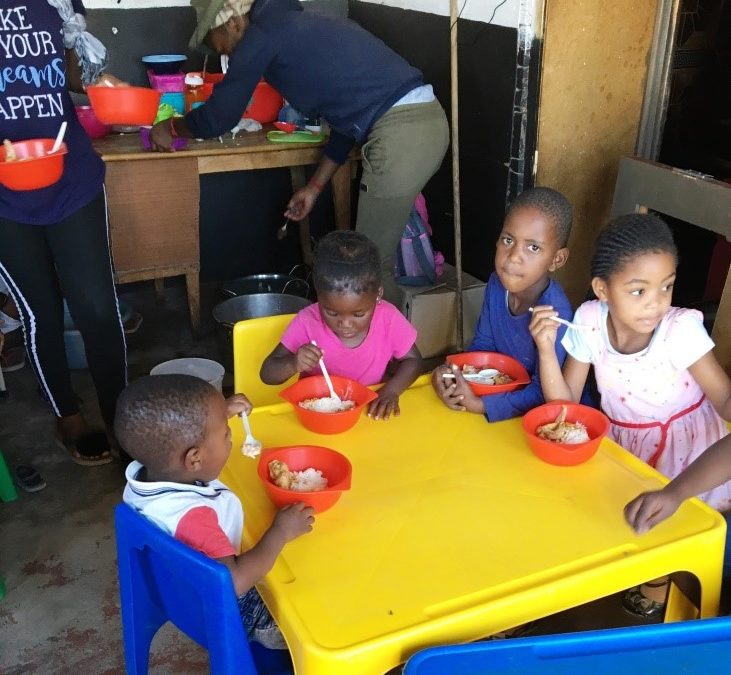
Image resolution: width=731 pixels, height=675 pixels. Find the location of `blue chair`. blue chair is located at coordinates (208, 585).